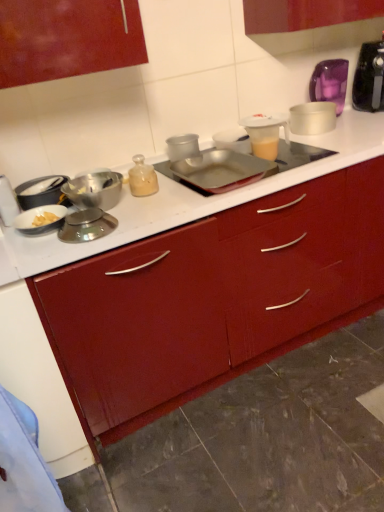
Where is `vacant region to the left of translucent plastic mixer at upper right`? vacant region to the left of translucent plastic mixer at upper right is located at coordinates (350, 119).